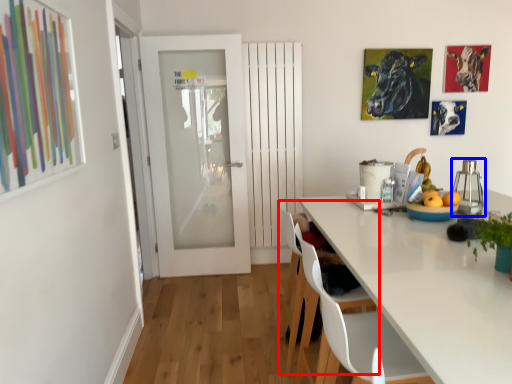
Question: Which object appears closest to the camera in this image, chair (highlighted by a red box) or appliance (highlighted by a blue box)?

Choices:
 (A) chair
 (B) appliance

Answer: (B)